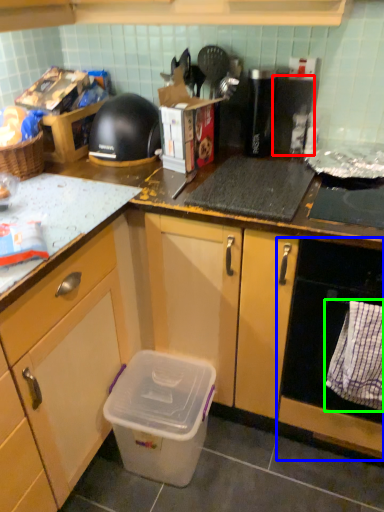
Question: Which object is positioned farthest from appliance (highlighted by a red box)? Select from oven (highlighted by a blue box) and cloth (highlighted by a green box).

Choices:
 (A) oven
 (B) cloth

Answer: (B)